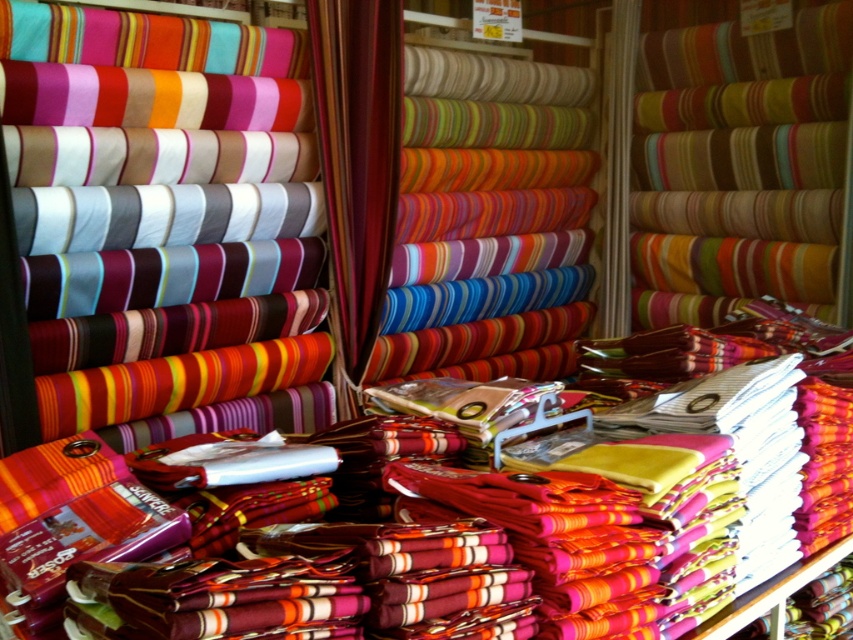
Who is lower down, multicolored striped fabric at center or silky striped fabric at center?

silky striped fabric at center

In the scene shown: Is multicolored striped fabric at center smaller than silky striped fabric at center?

Actually, multicolored striped fabric at center might be larger than silky striped fabric at center.

Is point (808, 237) positioned in front of point (326, 58)?

No, (808, 237) is further to viewer.

Image resolution: width=853 pixels, height=640 pixels. In order to click on multicolored striped fabric at center in this screenshot , I will do `click(741, 157)`.